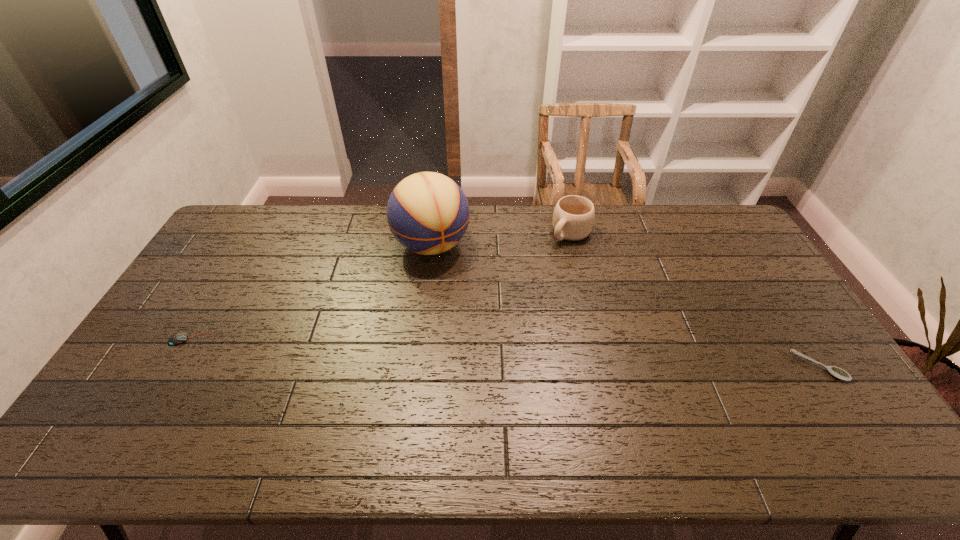
The image size is (960, 540). I want to click on vacant space on the desktop that is between the third farthest object and the nearest object and is positioned on the patterned surface of the third object from right to left, so click(493, 353).

At what (x,y) coordinates should I click in order to perform the action: click on free space on the desktop that is between the third farthest object and the soupspoon and is positioned on the side of the third object from left to right with the handle. Please return your answer as a coordinate pair (x, y). The width and height of the screenshot is (960, 540). Looking at the image, I should click on (444, 350).